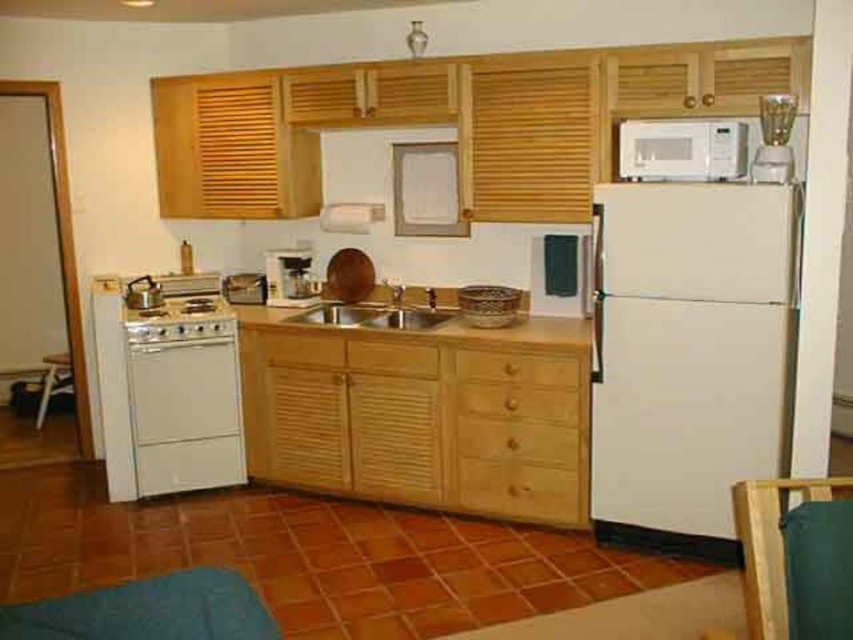
You are standing in the kitchen and want to reach the point at coordinates point (608, 300). If you can stretch your arm 1.2 meters, will you be able to reach that point without moving?

The distance between you and the point (608, 300) is 3.52 meters. Since your arm can only stretch 1.2 meters, you cannot reach it without moving closer.

You are organizing a kitchen and need to place a large cutting board. The light wood drawer at center and the metallic sink at center are both in the same area. Which object has enough space to accommodate the cutting board?

The light wood drawer at center has a larger size compared to the metallic sink at center, so it can accommodate the large cutting board.